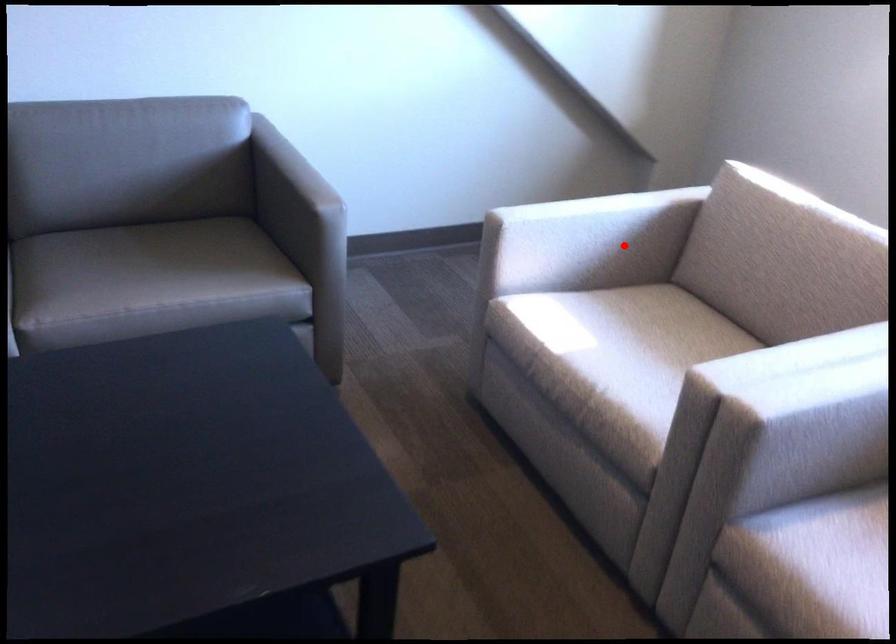
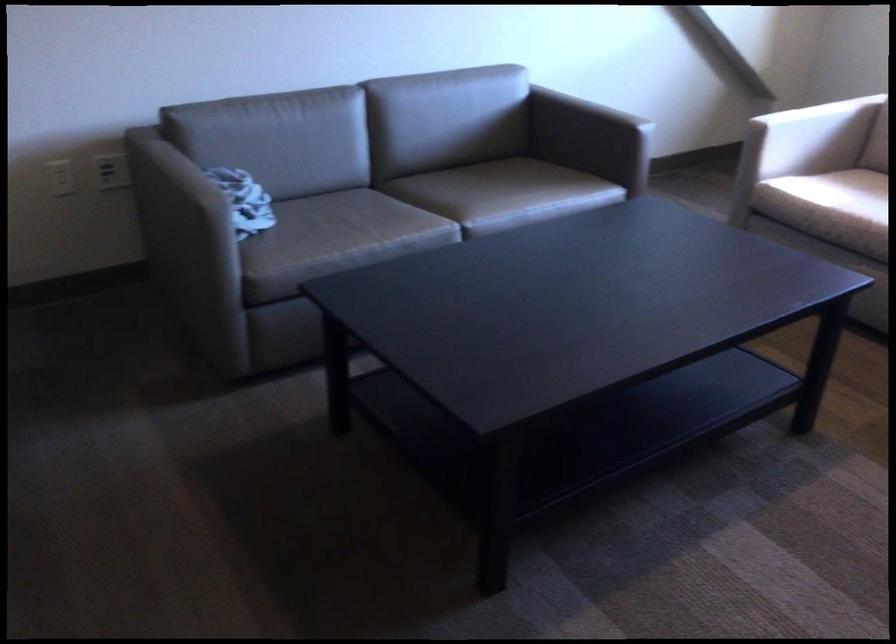
Question: I am providing you with two images of the same scene from different viewpoints. Given a red point in image1, look at the same physical point in image2. Is it:

Choices:
 (A) Closer to the viewpoint
 (B) Farther from the viewpoint

Answer: (B)